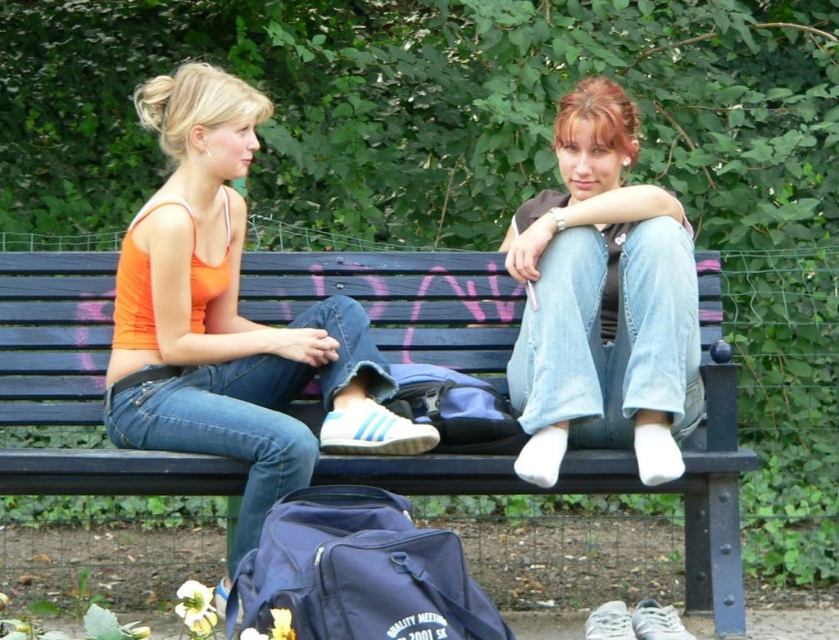
Question: Does orange fabric tank top at left come behind denim jeans at center?

Choices:
 (A) yes
 (B) no

Answer: (B)

Question: Is black wood bench at center smaller than orange fabric tank top at left?

Choices:
 (A) no
 (B) yes

Answer: (B)

Question: Which is farther from the black wood bench at center?

Choices:
 (A) orange fabric tank top at left
 (B) denim jeans at center

Answer: (A)

Question: Among these points, which one is nearest to the camera?

Choices:
 (A) (134, 259)
 (B) (176, 461)
 (C) (514, 342)

Answer: (B)

Question: Which of the following is the farthest from the observer?

Choices:
 (A) (680, 369)
 (B) (543, 492)

Answer: (B)

Question: Does black wood bench at center have a larger size compared to orange fabric tank top at left?

Choices:
 (A) no
 (B) yes

Answer: (A)